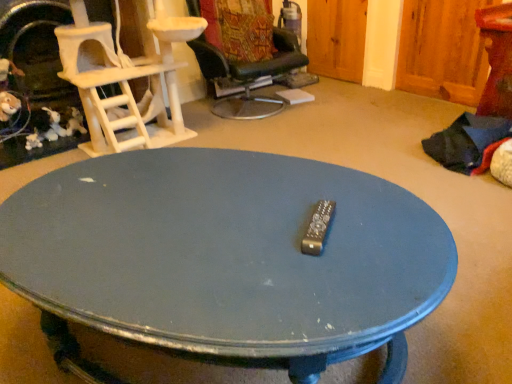
This screenshot has width=512, height=384. In order to click on vacant space underneath black leather chair at upper center, acting as the 1th chair starting from the right (from a real-world perspective) in this screenshot , I will do (252, 103).